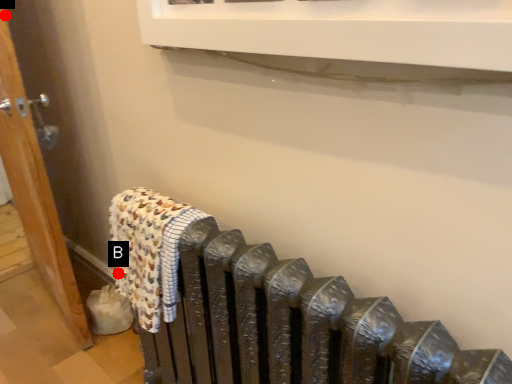
Question: Two points are circled on the image, labeled by A and B beside each circle. Which point appears closest to the camera in this image?

Choices:
 (A) A is closer
 (B) B is closer

Answer: (A)